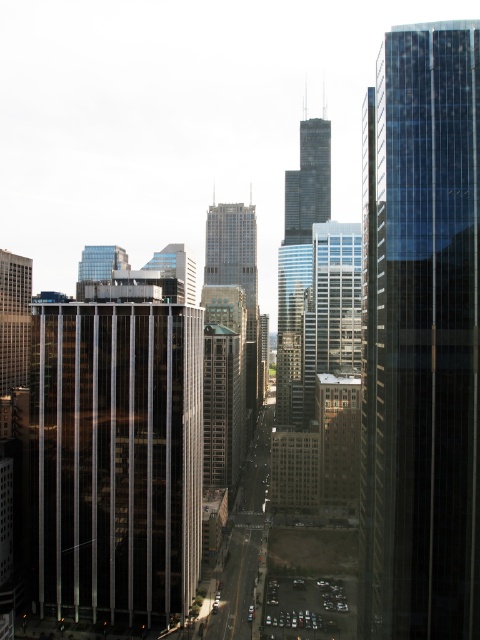
Question: Among these objects, which one is nearest to the camera?

Choices:
 (A) glassy steel skyscraper at center
 (B) clear glass skyscraper at center

Answer: (B)

Question: Is transparent glass skyscraper at right smaller than glassy steel skyscraper at center?

Choices:
 (A) yes
 (B) no

Answer: (A)

Question: Which point is closer to the camera taking this photo?

Choices:
 (A) (326, 355)
 (B) (176, 262)

Answer: (A)

Question: Which of the following is the closest to the observer?

Choices:
 (A) (236, 236)
 (B) (477, 394)
 (C) (355, 355)

Answer: (B)

Question: Does transparent glass skyscraper at right appear on the right side of clear glass skyscraper at center?

Choices:
 (A) yes
 (B) no

Answer: (B)

Question: Is clear glass skyscraper at center below matte glass building at center?

Choices:
 (A) yes
 (B) no

Answer: (A)